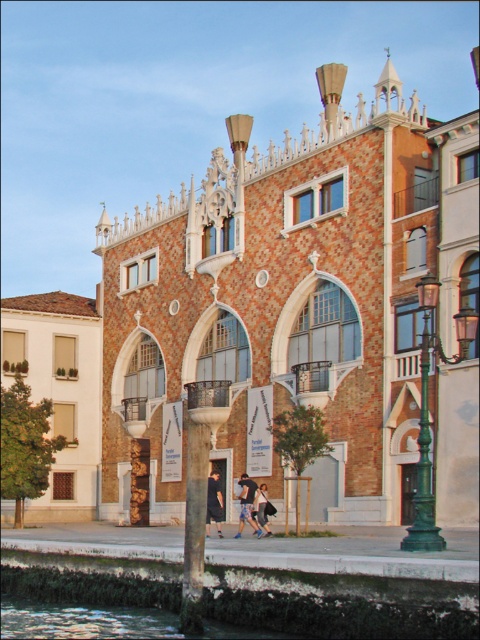
You are standing at the entrance of the historical building and want to locate the green metal lamp post at lower right. According to the coordinates provided, where should you look relative to your position?

The green metal lamp post at lower right is located at point 0.645 on the horizontal axis and 0.892 on the vertical axis relative to your position, meaning it is positioned to the right and slightly below your line of sight.

You are a tour guide leading a group along the canal and need to ensure a small delivery cart can pass between the green metal lamp post at lower right and the dark gray fabric pants at center. The cart is 3.5 meters wide. Is there enough space for the cart to pass through?

The distance between the green metal lamp post at lower right and the dark gray fabric pants at center is 10.19 meters. Since the cart is only 3.5 meters wide, there is ample space for it to pass through comfortably.

You are a tourist standing in front of the historical building and see the dark blue fabric at center and the denim pants at lower center. Which item is located to the left of the other?

The dark blue fabric at center is positioned on the left side of denim pants at lower center.